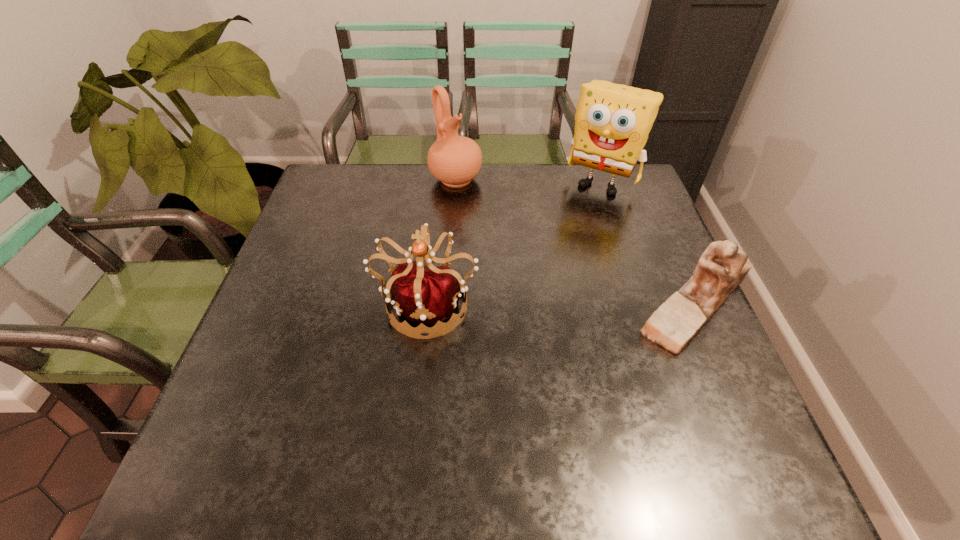
You are a GUI agent. You are given a task and a screenshot of the screen. Output one action in this format:
    pyautogui.click(x=<x>, y=<y>)
    Task: Click on the vacant space on the desktop that is between the second shortest object and the shortest object and is positioned on the face of the sponge
    This screenshot has height=540, width=960.
    Given the screenshot: What is the action you would take?
    528,303

Identify the location of vacant spot on the desktop that is between the tiara and the figurine and is positioned on the spout of the pottery. This screenshot has width=960, height=540. (584, 303).